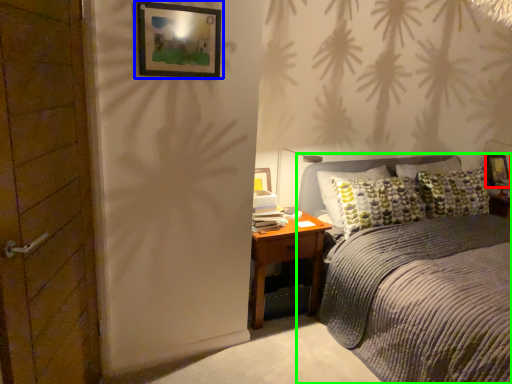
Question: Which object is positioned farthest from picture frame (highlighted by a red box)? Select from picture frame (highlighted by a blue box) and bed (highlighted by a green box).

Choices:
 (A) picture frame
 (B) bed

Answer: (A)